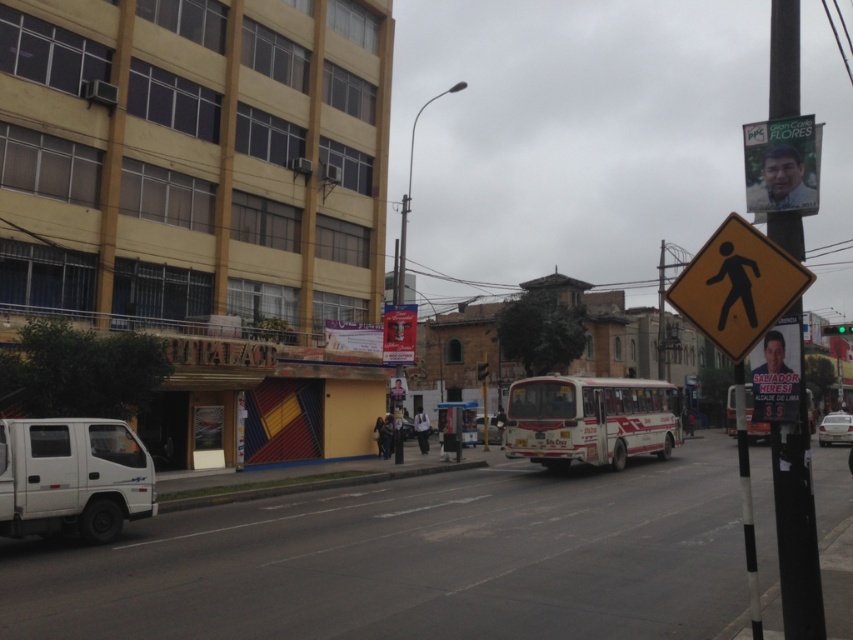
You are standing at the pedestrian crossing sign with a black silhouette of a person walking against a yellow background. You want to take a photo of the white matte van at lower left from where you are standing. Is the van within a 50 feet range of your camera?

The distance between the white matte van at lower left and the camera is 34.16 feet, which is within the 50 feet range. Therefore, the van is within the camera range.

You are standing at the point with coordinates point (831, 326) and want to walk to the point with coordinates point (115, 474). According to the scene description, which direction should you head?

Point (115, 474) is in front of point (831, 326), so you should head forward towards point (115, 474).

You are a driver approaching the intersection and see the yellow reflective pedestrian crossing sign at upper right and the yellow plastic pedestrian sign at upper right. Which one is taller?

The yellow plastic pedestrian sign at upper right is taller than the yellow reflective pedestrian crossing sign at upper right.